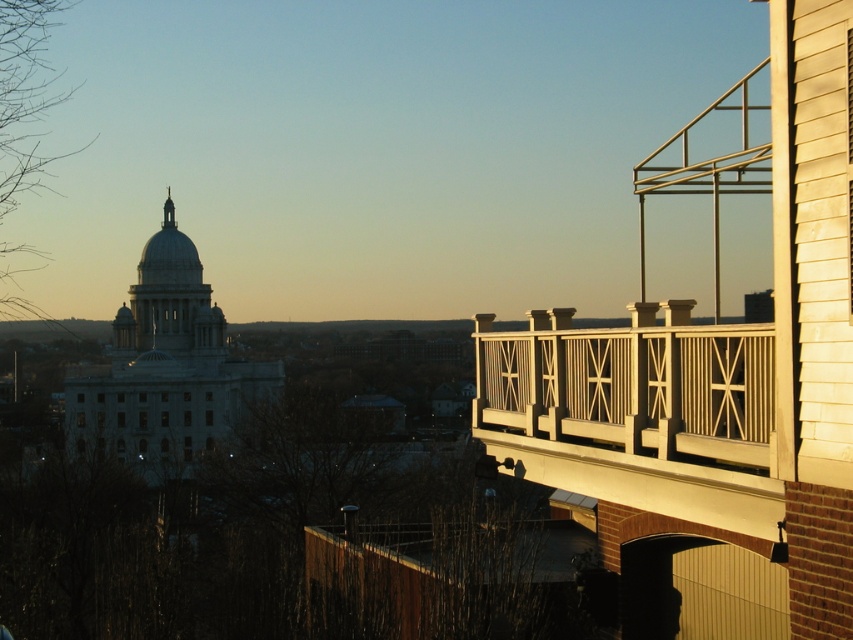
In the scene shown: Which of these two, white painted wood balcony at upper right or white smooth dome at upper center, stands shorter?

With less height is white painted wood balcony at upper right.

Between white painted wood balcony at upper right and white smooth dome at upper center, which one is positioned lower?

white painted wood balcony at upper right is lower down.

At what (x,y) coordinates should I click in order to perform the action: click on white painted wood balcony at upper right. Please return your answer as a coordinate pair (x, y). Image resolution: width=853 pixels, height=640 pixels. Looking at the image, I should click on (631, 392).

The width and height of the screenshot is (853, 640). Find the location of `white painted wood balcony at upper right`. white painted wood balcony at upper right is located at coordinates (631, 392).